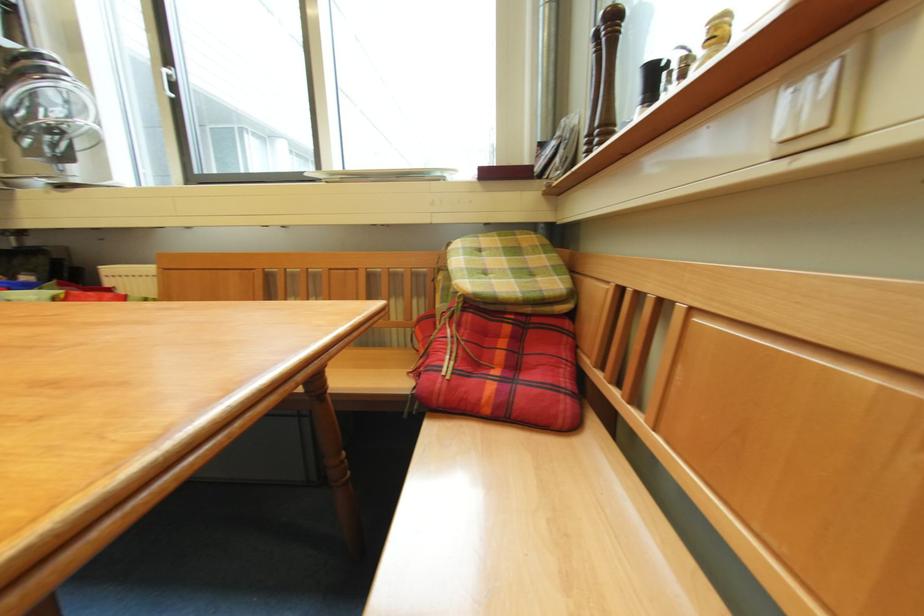
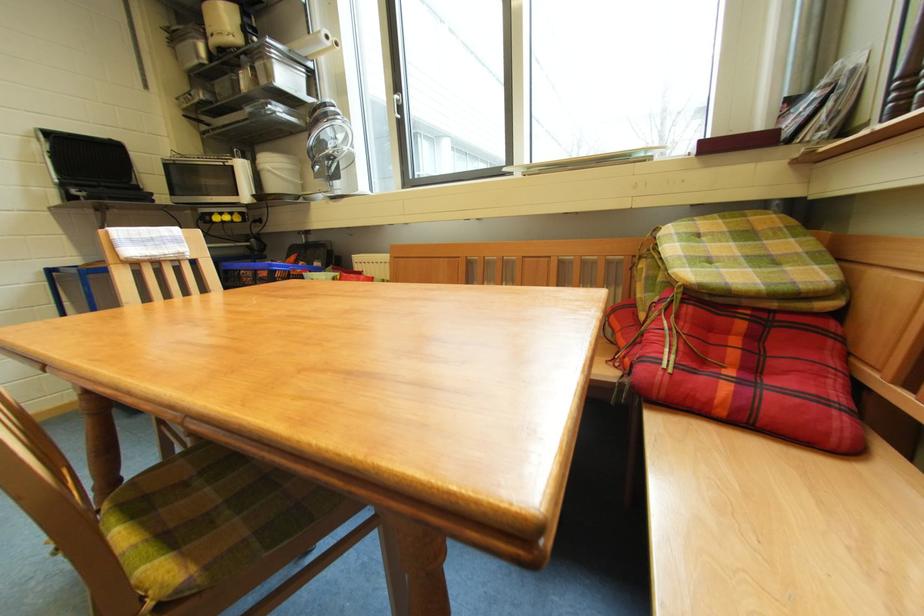
What movement of the cameraman would produce the second image?

The cameraman walked toward left, backward.